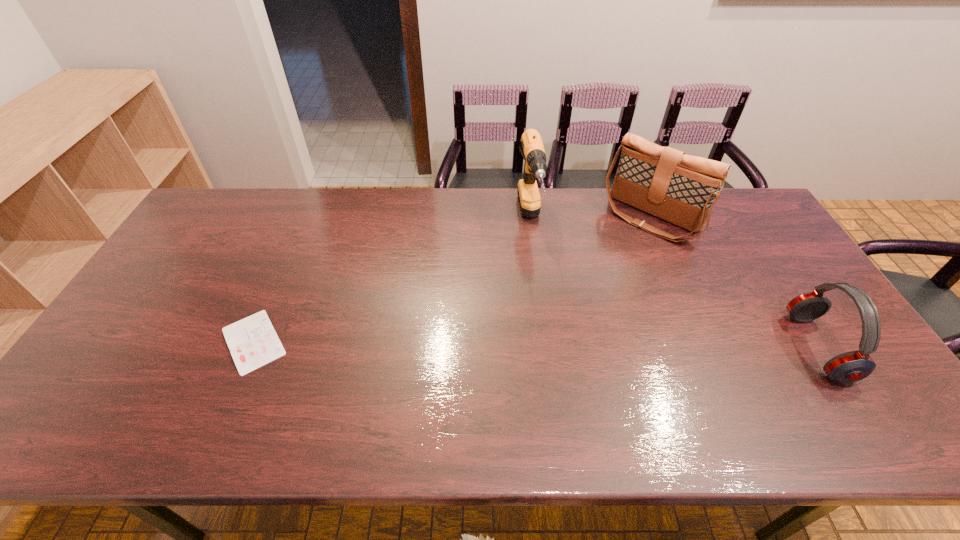
The image size is (960, 540). Find the location of `vacant area that lies between the rightmost object and the shortest object`. vacant area that lies between the rightmost object and the shortest object is located at coordinates (535, 344).

What are the coordinates of `object that is the second closest to the diary` in the screenshot? It's located at (681, 189).

This screenshot has height=540, width=960. Find the location of `object that is the second closest to the second shortest object`. object that is the second closest to the second shortest object is located at coordinates (535, 165).

You are a GUI agent. You are given a task and a screenshot of the screen. Output one action in this format:
    pyautogui.click(x=<x>, y=<y>)
    Task: Click on the vacant region that satisfies the following two spatial constraints: 1. on the back side of the leftmost object; 2. on the right side of the third object from right to left
    This screenshot has height=540, width=960.
    Given the screenshot: What is the action you would take?
    pyautogui.click(x=306, y=220)

Find the location of a particular element. The height and width of the screenshot is (540, 960). free point that satisfies the following two spatial constraints: 1. on the back side of the second object from left to right; 2. on the right side of the shoulder bag is located at coordinates (530, 218).